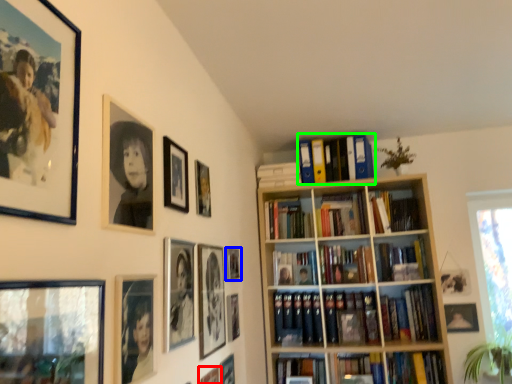
Question: Based on their relative distances, which object is farther from picture frame (highlighted by a red box)? Choose from picture frame (highlighted by a blue box) and book (highlighted by a green box).

Choices:
 (A) picture frame
 (B) book

Answer: (B)